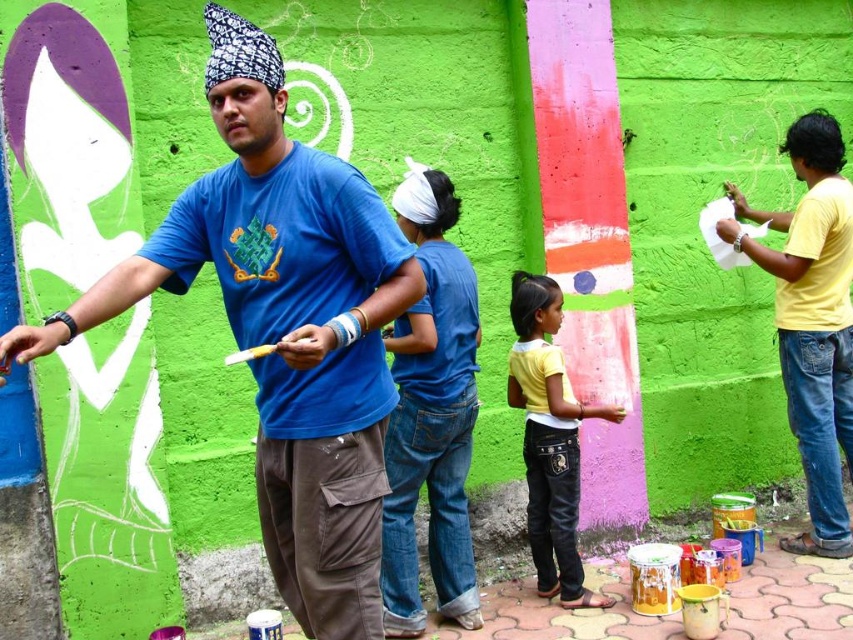
Can you confirm if yellow matte shirt at right is positioned below yellow cotton shirt at center?

Actually, yellow matte shirt at right is above yellow cotton shirt at center.

Which is behind, point (769, 257) or point (537, 294)?

Point (769, 257)

What do you see at coordinates (811, 320) in the screenshot? I see `yellow matte shirt at right` at bounding box center [811, 320].

This screenshot has width=853, height=640. Find the location of `yellow matte shirt at right`. yellow matte shirt at right is located at coordinates (811, 320).

Can you confirm if blue t-shirt at center is thinner than yellow matte shirt at right?

No, blue t-shirt at center is not thinner than yellow matte shirt at right.

Can you confirm if blue t-shirt at center is positioned below yellow matte shirt at right?

Actually, blue t-shirt at center is above yellow matte shirt at right.

I want to click on blue t-shirt at center, so point(283,326).

Does denim jeans at center appear under yellow cotton shirt at center?

Incorrect, denim jeans at center is not positioned below yellow cotton shirt at center.

Based on the photo, which is more to the right, denim jeans at center or yellow cotton shirt at center?

yellow cotton shirt at center

Locate an element on the screen. This screenshot has height=640, width=853. denim jeans at center is located at coordinates (431, 416).

The width and height of the screenshot is (853, 640). What are the coordinates of `denim jeans at center` in the screenshot? It's located at pos(431,416).